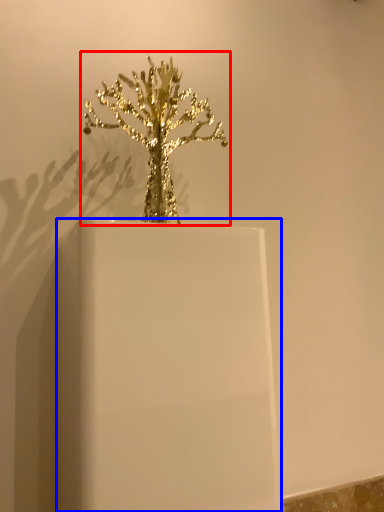
Question: Among these objects, which one is nearest to the camera, houseplant (highlighted by a red box) or candle holder (highlighted by a blue box)?

Choices:
 (A) houseplant
 (B) candle holder

Answer: (B)